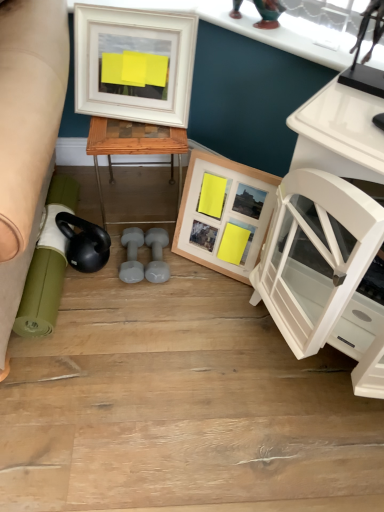
You are a GUI agent. You are given a task and a screenshot of the screen. Output one action in this format:
    pyautogui.click(x=<x>, y=<y>)
    Task: Click on the vacant region in front of gray rubber dumbbell at center, the 1th dumbbell from the right
    
    Given the screenshot: What is the action you would take?
    pyautogui.click(x=158, y=306)